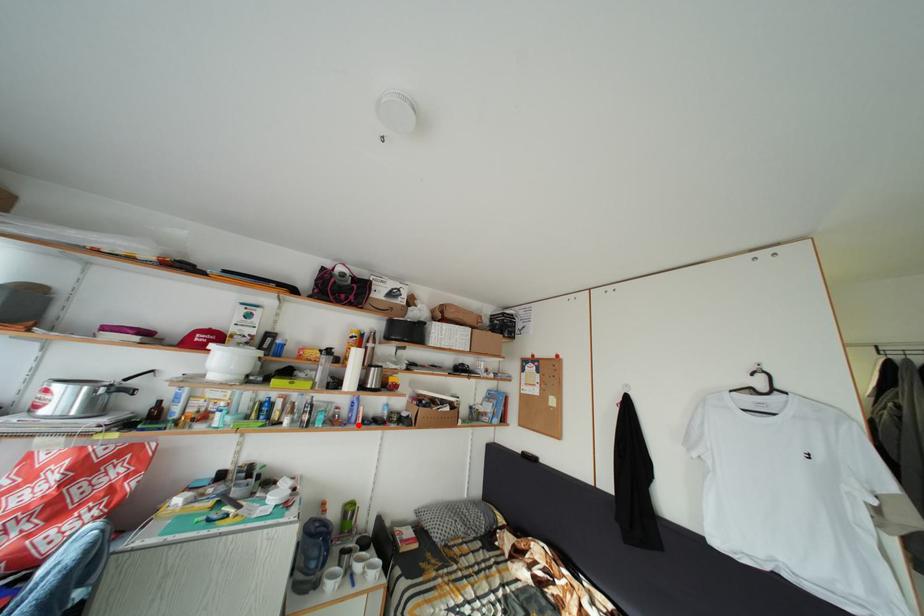
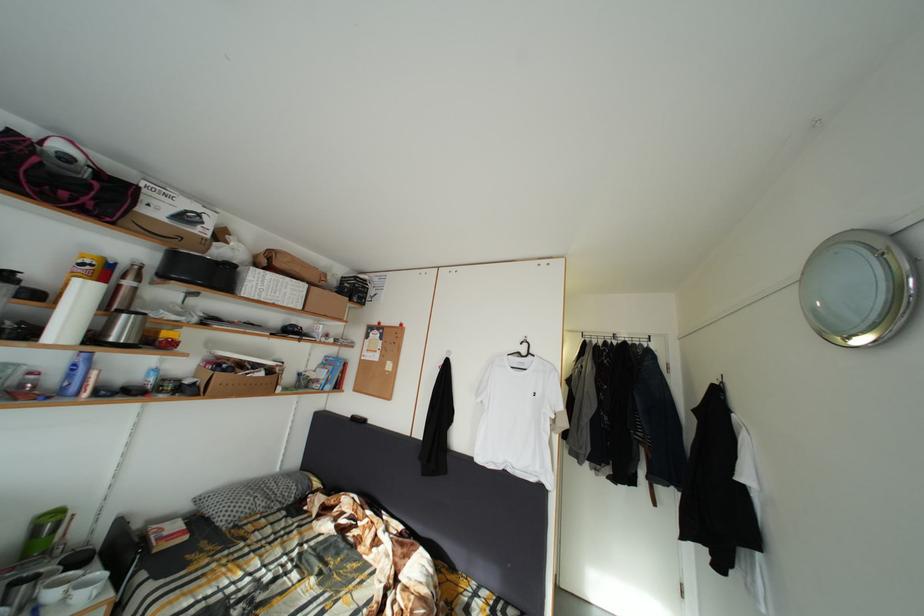
Locate, in the second image, the point that corresponds to the highlighted location in the first image.

(73, 395)